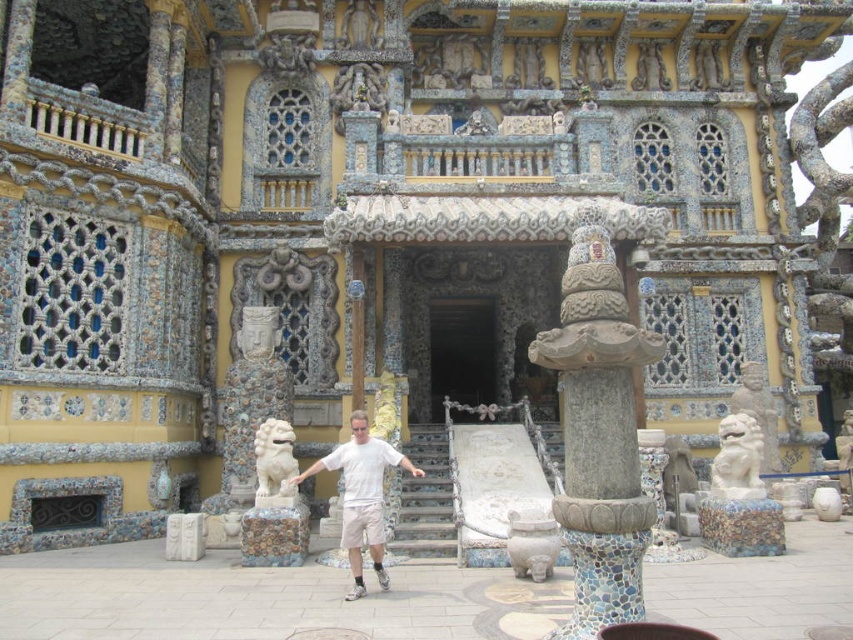
Who is more distant from viewer, (770, 432) or (634, 77)?

Point (634, 77)

Can you confirm if gray stone lion at center is smaller than carved stone statue at upper center?

No, gray stone lion at center is not smaller than carved stone statue at upper center.

Does point (766, 426) come closer to viewer compared to point (664, 80)?

Yes, it is.

The height and width of the screenshot is (640, 853). What are the coordinates of `gray stone lion at center` in the screenshot? It's located at (758, 412).

Is white matte shirt at center wider than smooth stone statue at upper center?

Correct, the width of white matte shirt at center exceeds that of smooth stone statue at upper center.

Does point (344, 448) come farther from viewer compared to point (345, 26)?

No.

Where is `white matte shirt at center`? The width and height of the screenshot is (853, 640). white matte shirt at center is located at coordinates (361, 496).

Is the position of stone stairs at center less distant than that of white marble lion at right?

That is False.

Where is `stone stairs at center`? The width and height of the screenshot is (853, 640). stone stairs at center is located at coordinates (424, 499).